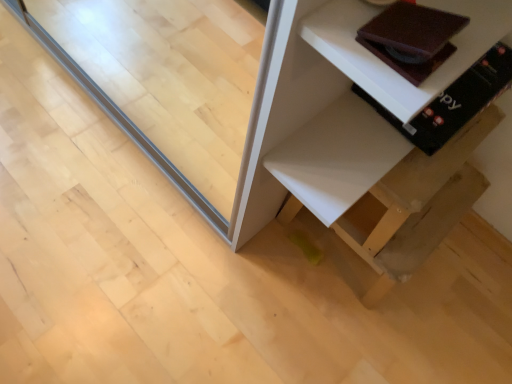
Question: Is white matte shelf at lower right situated inside brown leather book at upper right, the 2th book viewed from the front, or outside?

Choices:
 (A) outside
 (B) inside

Answer: (A)

Question: Based on their sizes in the image, would you say white matte shelf at lower right is bigger or smaller than brown leather book at upper right, placed as the 1th book when sorted from back to front?

Choices:
 (A) big
 (B) small

Answer: (A)

Question: Which object is the farthest from the white matte shelf at lower right?

Choices:
 (A) matte brown book at upper right, which appears as the second book when viewed from the back
 (B) brown leather book at upper right, placed as the 1th book when sorted from back to front
 (C) transparent glass door at center

Answer: (C)

Question: Which is nearer to the brown leather book at upper right, placed as the 1th book when sorted from back to front?

Choices:
 (A) transparent glass door at center
 (B) matte brown book at upper right, which appears as the second book when viewed from the back
 (C) white matte shelf at lower right

Answer: (C)